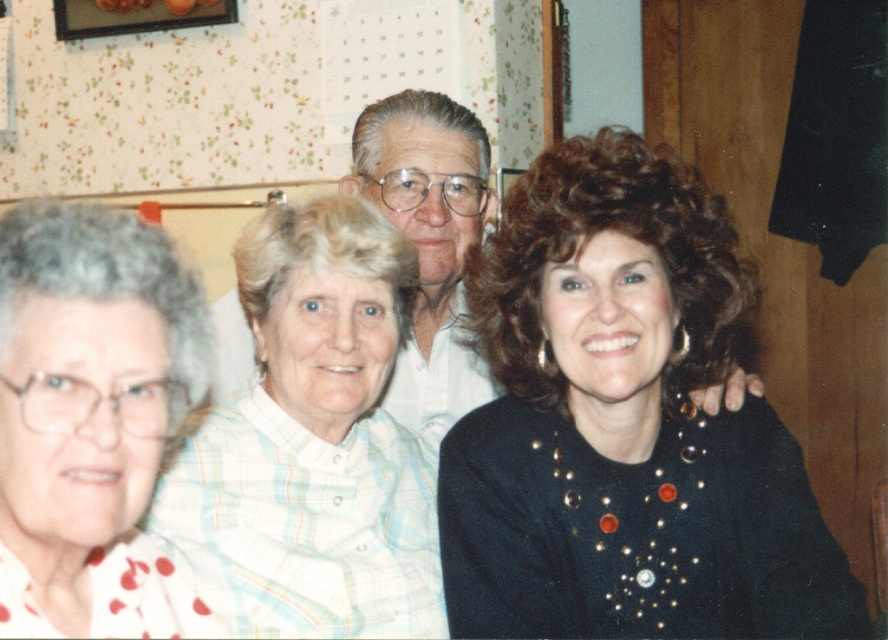
Is black sequined dress at center smaller than white dotted shirt at left?

Actually, black sequined dress at center might be larger than white dotted shirt at left.

Is black sequined dress at center to the left of white dotted shirt at left from the viewer's perspective?

Incorrect, black sequined dress at center is not on the left side of white dotted shirt at left.

In order to click on black sequined dress at center in this screenshot , I will do `click(624, 426)`.

Does white plaid shirt at center have a greater width compared to white dotted shirt at left?

Yes, white plaid shirt at center is wider than white dotted shirt at left.

Where is `white plaid shirt at center`? white plaid shirt at center is located at coordinates (312, 444).

I want to click on white plaid shirt at center, so click(x=312, y=444).

Describe the element at coordinates (312, 444) in the screenshot. I see `white plaid shirt at center` at that location.

Is point (224, 588) closer to viewer compared to point (462, 160)?

Yes, it is.

This screenshot has width=888, height=640. What are the coordinates of `white plaid shirt at center` in the screenshot? It's located at (312, 444).